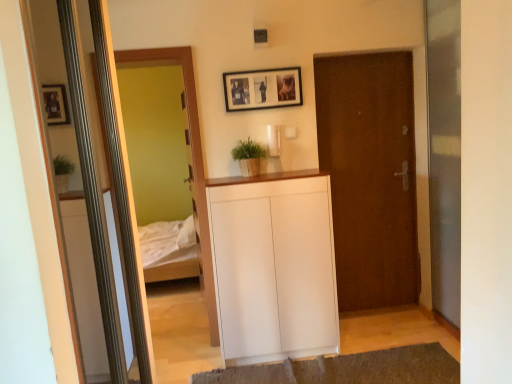
This screenshot has height=384, width=512. What do you see at coordinates (262, 89) in the screenshot? I see `wooden framed photo at upper center` at bounding box center [262, 89].

In the scene shown: What is the approximate height of brown textured rug at lower center?

It is 2.88 inches.

What do you see at coordinates (348, 369) in the screenshot?
I see `brown textured rug at lower center` at bounding box center [348, 369].

What do you see at coordinates (274, 266) in the screenshot? I see `white matte cabinet at center` at bounding box center [274, 266].

Identify the location of green matte plant at center. The width and height of the screenshot is (512, 384). (248, 150).

From the image's perspective, is brown textured rug at lower center under wooden framed mirror at left?

Correct, brown textured rug at lower center appears lower than wooden framed mirror at left in the image.

The width and height of the screenshot is (512, 384). What are the coordinates of `mirror that appears behind the brown textured rug at lower center` in the screenshot? It's located at (191, 166).

Considering the relative sizes of brown textured rug at lower center and wooden framed mirror at left in the image provided, is brown textured rug at lower center bigger than wooden framed mirror at left?

Result: No, brown textured rug at lower center is not bigger than wooden framed mirror at left.

From a real-world perspective, which object stands above the other?

wooden framed photo at upper center, from a real-world perspective.

Does wooden framed photo at upper center touch wooden framed mirror at left?

wooden framed photo at upper center is not next to wooden framed mirror at left, and they're not touching.

Which object is thinner, wooden framed photo at upper center or wooden framed mirror at left?

wooden framed photo at upper center.

Can you tell me how much green matte plant at center and brown textured rug at lower center differ in facing direction?

They differ by 1.9 degrees in their facing directions.

In terms of size, does green matte plant at center appear bigger or smaller than brown textured rug at lower center?

In the image, green matte plant at center appears to be smaller than brown textured rug at lower center.

Which is more to the right, green matte plant at center or brown textured rug at lower center?

Positioned to the right is brown textured rug at lower center.

Is transparent glass screen door at right not near wooden framed mirror at left?

transparent glass screen door at right is far away from wooden framed mirror at left.

Considering the sizes of transparent glass screen door at right and wooden framed mirror at left in the image, is transparent glass screen door at right taller or shorter than wooden framed mirror at left?

transparent glass screen door at right is taller than wooden framed mirror at left.

From the image's perspective, is transparent glass screen door at right below wooden framed mirror at left?

No, from the image's perspective, transparent glass screen door at right is not below wooden framed mirror at left.

Is green matte plant at center taller or shorter than wooden framed mirror at left?

Considering their sizes, green matte plant at center has less height than wooden framed mirror at left.

From the image's perspective, is green matte plant at center located above or below wooden framed mirror at left?

green matte plant at center is above wooden framed mirror at left.

From the picture: Measure the distance between green matte plant at center and wooden framed mirror at left.

green matte plant at center is 23.18 inches from wooden framed mirror at left.

Is green matte plant at center smaller than wooden framed mirror at left?

Correct, green matte plant at center occupies less space than wooden framed mirror at left.

Which is less distant, (248, 294) or (342, 94)?

Point (248, 294) appears to be closer to the viewer than point (342, 94).

The height and width of the screenshot is (384, 512). What are the coordinates of `door to the right of white matte cabinet at center` in the screenshot? It's located at (370, 175).

From a real-world perspective, which is physically above, white matte cabinet at center or brown matte door at center?

From a 3D spatial view, brown matte door at center is above.

Based on their sizes in the image, would you say white matte cabinet at center is bigger or smaller than brown matte door at center?

white matte cabinet at center is bigger than brown matte door at center.

Looking at this image, is green matte plant at center inside brown textured rug at lower center?

No, green matte plant at center is not a part of brown textured rug at lower center.

Can you tell me how much brown textured rug at lower center and green matte plant at center differ in facing direction?

There is a 1.9-degree angle between the facing directions of brown textured rug at lower center and green matte plant at center.

Which is more to the left, brown textured rug at lower center or green matte plant at center?

Positioned to the left is green matte plant at center.

Measure the distance from brown textured rug at lower center to green matte plant at center.

brown textured rug at lower center is 4.94 feet away from green matte plant at center.

You are a GUI agent. You are given a task and a screenshot of the screen. Output one action in this format:
    pyautogui.click(x=<x>, y=<y>)
    Task: Click on the mirror above the brown textured rug at lower center (from the image's perspective)
    
    Given the screenshot: What is the action you would take?
    point(191,166)

Where is `mirror lying below the wooden framed photo at upper center (from the image's perspective)`? The image size is (512, 384). mirror lying below the wooden framed photo at upper center (from the image's perspective) is located at coordinates (191, 166).

Considering their positions, is wooden framed photo at upper center positioned closer to brown matte door at center than brown textured rug at lower center?

wooden framed photo at upper center.

From the image, which object appears to be farther from brown textured rug at lower center, green matte plant at center or wooden framed mirror at left?

green matte plant at center.

Looking at the image, which one is located closer to green matte plant at center, white matte cabinet at center or brown textured rug at lower center?

white matte cabinet at center lies closer to green matte plant at center than the other object.

Based on the photo, considering their positions, is brown textured rug at lower center positioned further to green matte plant at center than wooden framed photo at upper center?

Among the two, brown textured rug at lower center is located further to green matte plant at center.

From the image, which object appears to be nearer to wooden framed mirror at left, wooden framed photo at upper center or brown matte door at center?

Among the two, wooden framed photo at upper center is located nearer to wooden framed mirror at left.

Consider the image. From the image, which object appears to be farther from transparent glass screen door at right, brown textured rug at lower center or brown matte door at center?

brown textured rug at lower center lies further to transparent glass screen door at right than the other object.

Based on the photo, looking at the image, which one is located closer to green matte plant at center, wooden framed mirror at left or brown textured rug at lower center?

wooden framed mirror at left is positioned closer to the anchor green matte plant at center.

Which object lies nearer to the anchor point white matte cabinet at center, brown textured rug at lower center or wooden framed mirror at left?

wooden framed mirror at left is closer to white matte cabinet at center.

Image resolution: width=512 pixels, height=384 pixels. Find the location of `door between green matte plant at center and brown textured rug at lower center from top to bottom`. door between green matte plant at center and brown textured rug at lower center from top to bottom is located at coordinates (370, 175).

This screenshot has width=512, height=384. I want to click on cabinetry between wooden framed mirror at left and transparent glass screen door at right, so click(274, 266).

Where is `screen door between green matte plant at center and brown textured rug at lower center in the vertical direction`? This screenshot has width=512, height=384. screen door between green matte plant at center and brown textured rug at lower center in the vertical direction is located at coordinates (444, 153).

At what (x,y) coordinates should I click in order to perform the action: click on cabinetry between wooden framed photo at upper center and transparent glass screen door at right. Please return your answer as a coordinate pair (x, y). Looking at the image, I should click on (274, 266).